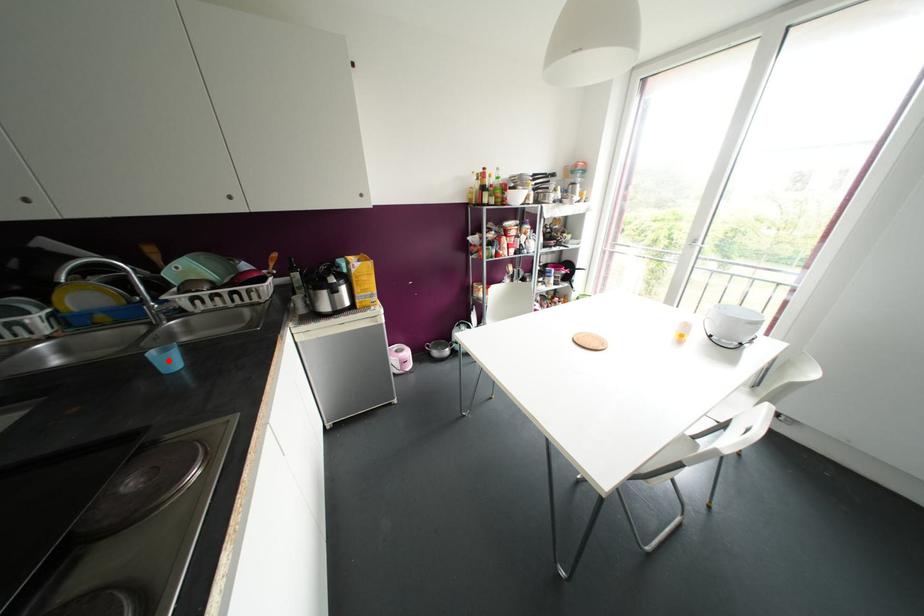
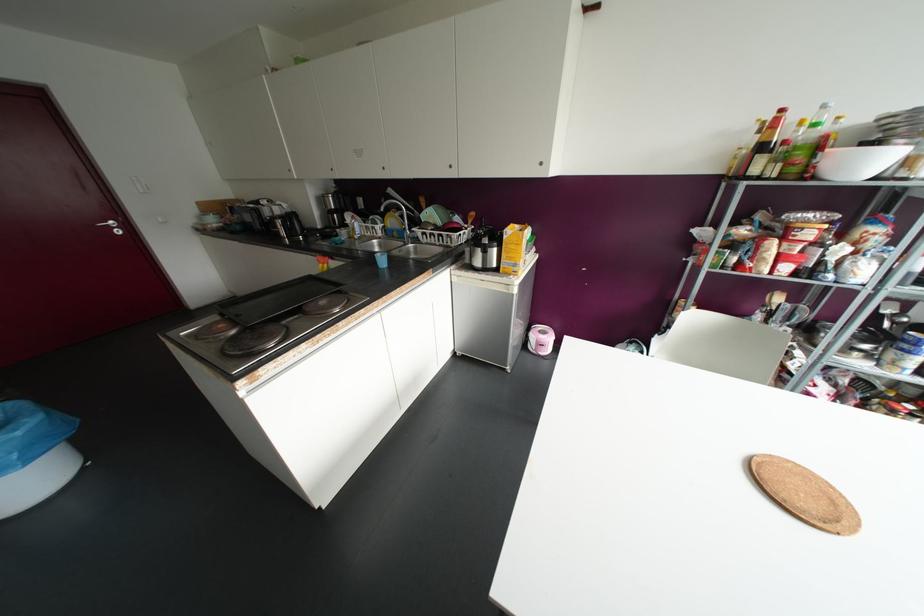
Find the pixel in the second image that matches the highlighted location in the first image.

(382, 261)